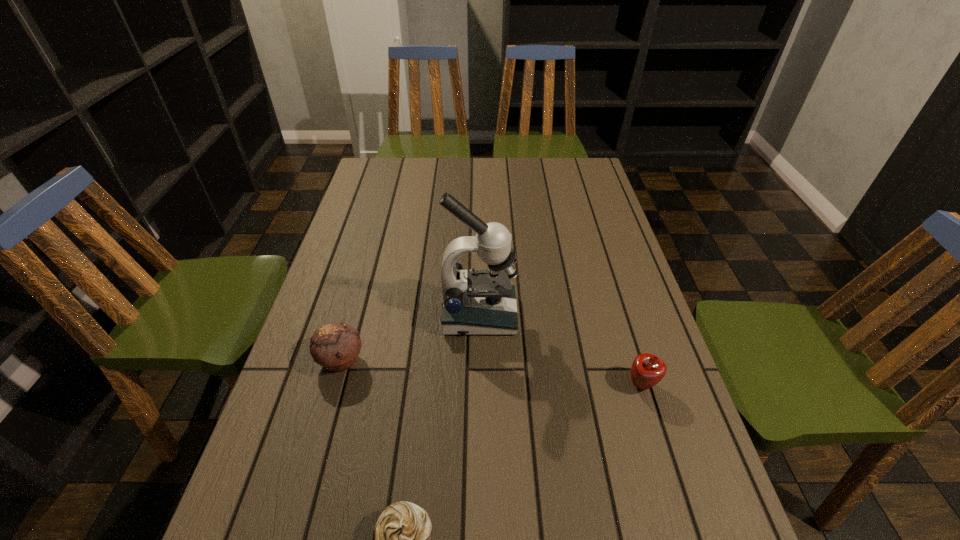
The image size is (960, 540). In order to click on vacant point at the far edge in this screenshot , I will do `click(438, 170)`.

Locate an element on the screen. The height and width of the screenshot is (540, 960). free space at the left edge of the desktop is located at coordinates (x=332, y=280).

This screenshot has width=960, height=540. What are the coordinates of `vacant region at the right edge of the desktop` in the screenshot? It's located at [x=621, y=291].

Identify the location of free space between the farther muffin and the farthest object. This screenshot has width=960, height=540. (410, 338).

Where is `free space between the farther muffin and the farthest object`? free space between the farther muffin and the farthest object is located at coordinates (410, 338).

Image resolution: width=960 pixels, height=540 pixels. In order to click on unoccupied position between the apple and the farther muffin in this screenshot , I will do `click(492, 372)`.

At what (x,y) coordinates should I click in order to perform the action: click on free space that is in between the tallest object and the rightmost object. Please return your answer as a coordinate pair (x, y). This screenshot has width=960, height=540. Looking at the image, I should click on (561, 350).

Locate an element on the screen. The width and height of the screenshot is (960, 540). free spot between the farther muffin and the apple is located at coordinates (492, 372).

Find the location of `unoccupied area between the leftmost object and the apple`. unoccupied area between the leftmost object and the apple is located at coordinates [492, 372].

Locate an element on the screen. This screenshot has width=960, height=540. free spot between the apple and the tallest object is located at coordinates (561, 350).